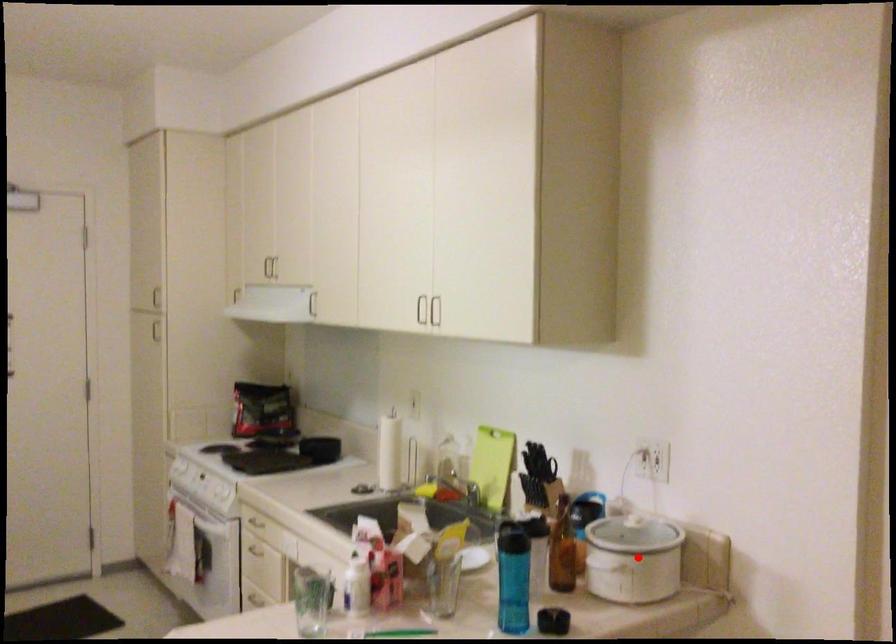
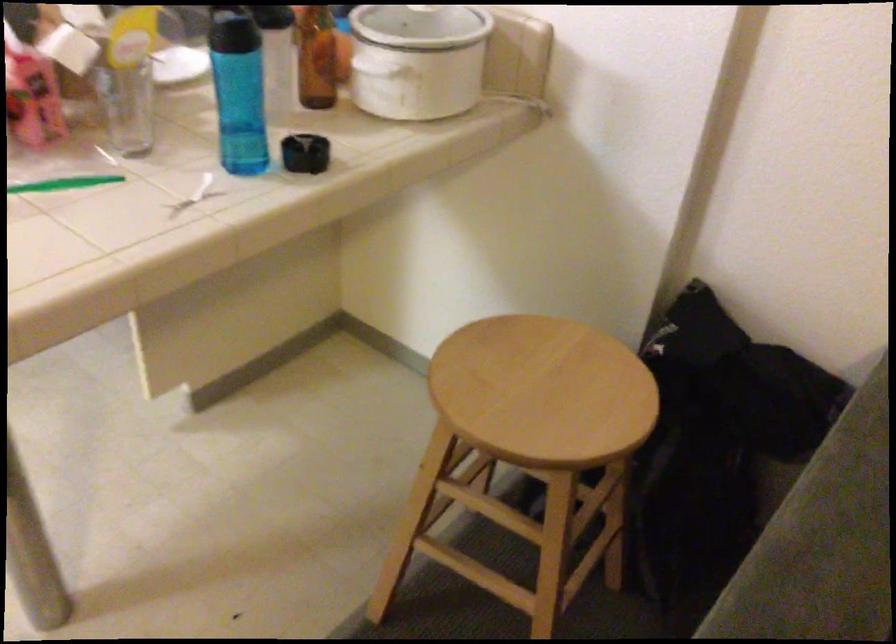
Where in the second image is the point corresponding to the highlighted location from the first image?

(418, 60)